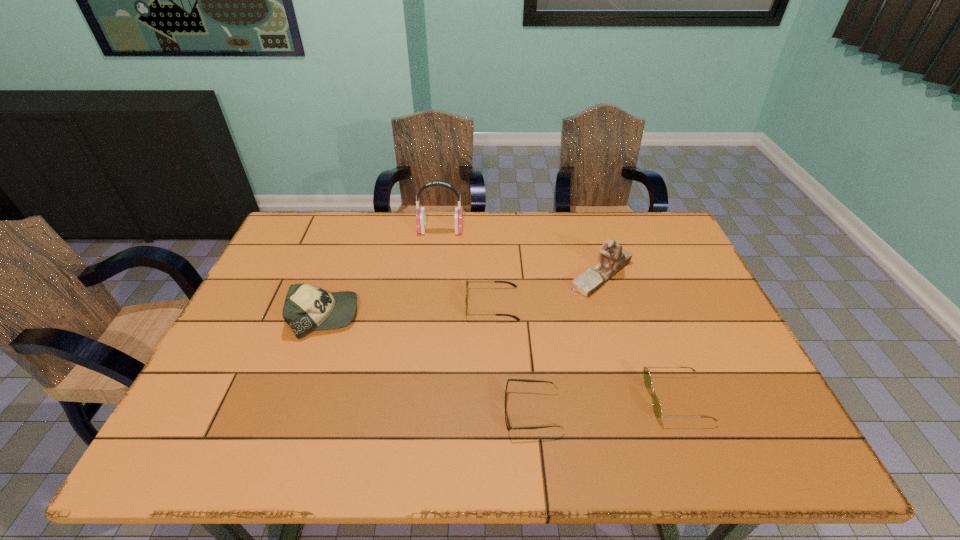
In order to click on free space located 0.230m on the lenses of the shortest sunglasses in this screenshot , I will do `click(401, 411)`.

The height and width of the screenshot is (540, 960). Find the location of `vacant space situated 0.210m on the lenses of the shortest sunglasses`. vacant space situated 0.210m on the lenses of the shortest sunglasses is located at coordinates (410, 411).

Image resolution: width=960 pixels, height=540 pixels. Identify the location of earphone that is at the far edge. (420, 217).

Find the location of `figurine that is positioned at the far edge`. figurine that is positioned at the far edge is located at coordinates (612, 259).

You are a GUI agent. You are given a task and a screenshot of the screen. Output one action in this format:
    pyautogui.click(x=<x>, y=<y>)
    Task: Click on the object present at the left edge
    
    Given the screenshot: What is the action you would take?
    pyautogui.click(x=307, y=308)

Where is `object present at the right edge`? This screenshot has height=540, width=960. object present at the right edge is located at coordinates (657, 409).

Where is `object present at the near right corner`? This screenshot has width=960, height=540. object present at the near right corner is located at coordinates (657, 409).

Where is `vacant space at the far edge of the desktop`? The width and height of the screenshot is (960, 540). vacant space at the far edge of the desktop is located at coordinates (429, 228).

Identify the location of free space at the near edge of the desktop. (621, 433).

Image resolution: width=960 pixels, height=540 pixels. In the image, there is a desktop. What are the coordinates of `free space at the left edge` in the screenshot? It's located at (224, 392).